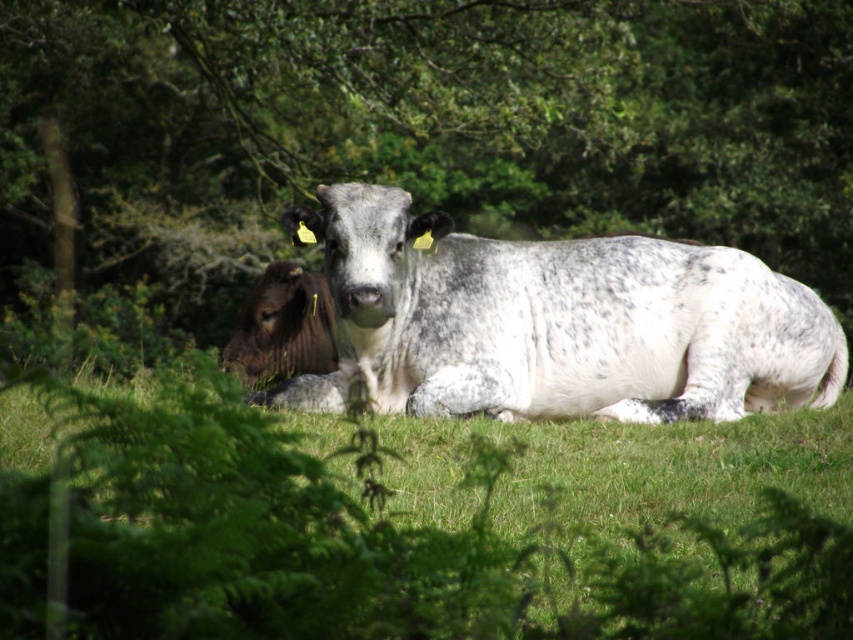
Question: Among these objects, which one is nearest to the camera?

Choices:
 (A) green grassy at center
 (B) dark brown fur at left
 (C) speckled white cow at center
 (D) green leafy tree at center

Answer: (A)

Question: Which object appears farthest from the camera in this image?

Choices:
 (A) green grassy at center
 (B) green leafy tree at center
 (C) speckled white cow at center
 (D) dark brown fur at left

Answer: (B)

Question: Is green grassy at center positioned before speckled white cow at center?

Choices:
 (A) no
 (B) yes

Answer: (B)

Question: Does green grassy at center have a greater width compared to dark brown fur at left?

Choices:
 (A) yes
 (B) no

Answer: (A)

Question: Which point is closer to the camera taking this photo?

Choices:
 (A) (51, 188)
 (B) (335, 372)
 (C) (253, 364)
 (D) (376, 608)

Answer: (D)

Question: Can you confirm if green leafy tree at center is positioned to the right of dark brown fur at left?

Choices:
 (A) yes
 (B) no

Answer: (A)